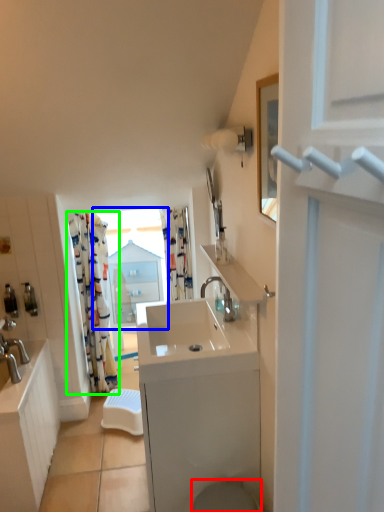
Question: Based on their relative distances, which object is nearer to toilet bowl (highlighted by a red box)? Choose from window (highlighted by a blue box) and curtain (highlighted by a green box).

Choices:
 (A) window
 (B) curtain

Answer: (B)